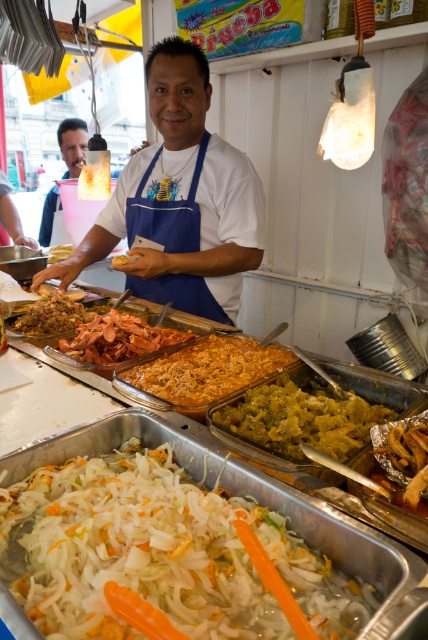
Question: Estimate the real-world distances between objects in this image. Which object is farther from the yellow matte bread at center?

Choices:
 (A) golden brown crispy at center
 (B) sliced pinkish meat at center
 (C) white translucent shredded vegetables at center

Answer: (C)

Question: Which object appears farthest from the camera in this image?

Choices:
 (A) greenish-yellow shredded at center
 (B) sliced pinkish meat at center
 (C) yellow matte bread at center

Answer: (C)

Question: Does white matte apron at center appear on the right side of shiny brown meat at center?

Choices:
 (A) yes
 (B) no

Answer: (B)

Question: Does white matte apron at center appear over golden brown crispy at center?

Choices:
 (A) no
 (B) yes

Answer: (B)

Question: Which object is closer to the camera taking this photo?

Choices:
 (A) white translucent plastic tray at center
 (B) yellow matte bread at center

Answer: (A)

Question: Can you confirm if white matte apron at center is positioned to the left of shiny brown meat at center?

Choices:
 (A) yes
 (B) no

Answer: (A)